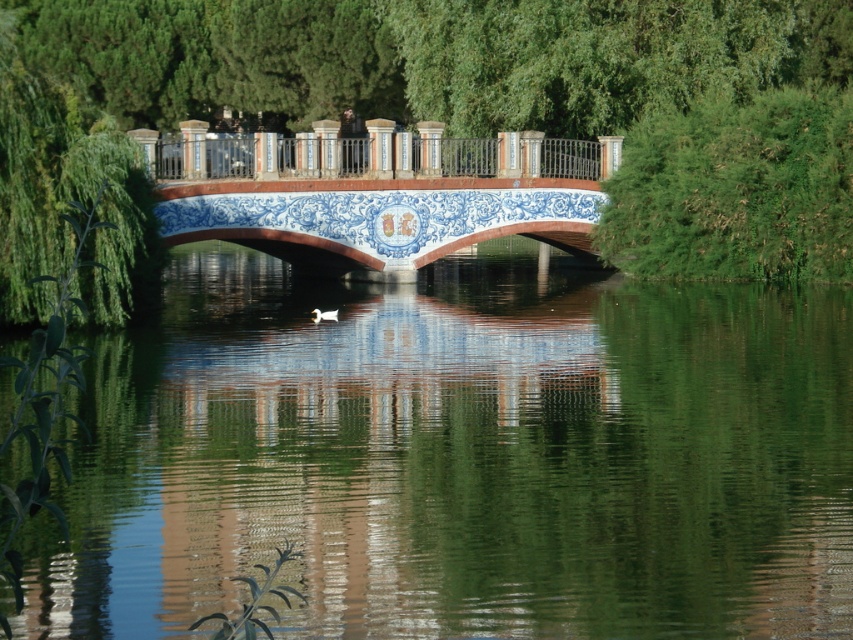
From the picture: You are a painter standing on the blue ceramic bridge at center, looking towards the green leafy tree at center. Which object is higher from the ground?

The green leafy tree at center is taller than the blue ceramic bridge at center, so the green leafy tree at center is higher from the ground.

You are a painter standing on the bridge and want to capture the scene. You have a canvas that can only fit objects up to 2 meters wide. Which object between the green leafy tree at center and the metallic polished railing at center should you choose to paint if you want to ensure it fits on your canvas?

The metallic polished railing at center is narrower than the green leafy tree at center. Since the canvas can only fit objects up to 2 meters wide, you should choose the metallic polished railing at center to paint as it is more likely to fit within the canvas size.

You are a painter standing on the bridge and want to capture the scene in front of you. Which object, the green leafy tree at center or the metallic polished railing at center, would appear taller in your painting?

The green leafy tree at center is taller than the metallic polished railing at center, so it would appear taller in the painting.